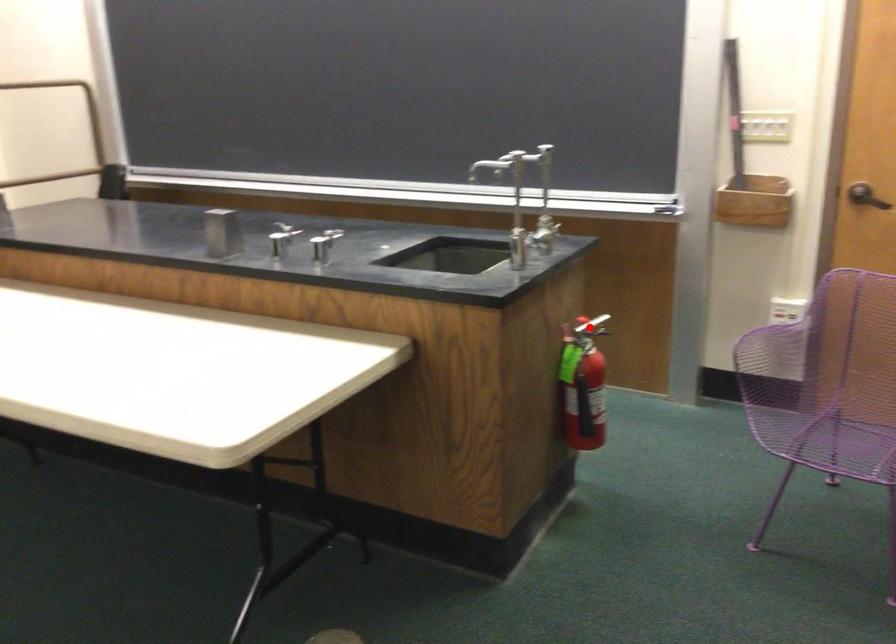
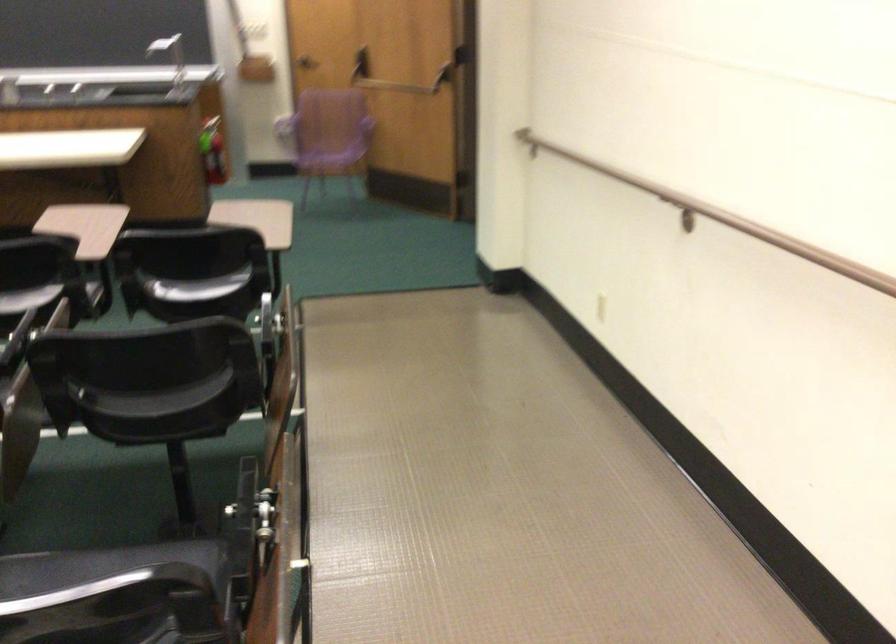
Question: I am providing you with two images of the same scene from different viewpoints. A red point is marked on the first image. At the location where the point appears in image 1, is it still visible in image 2?

Choices:
 (A) Yes
 (B) No

Answer: (A)